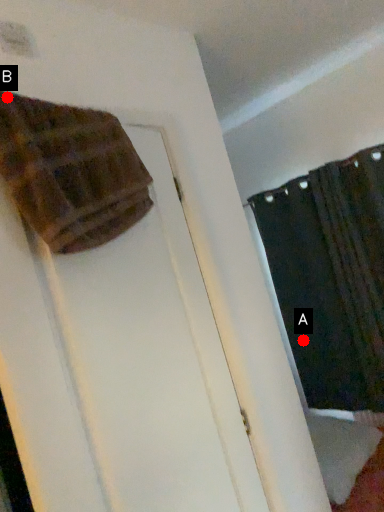
Question: Two points are circled on the image, labeled by A and B beside each circle. Which of the following is the farthest from the observer?

Choices:
 (A) A is further
 (B) B is further

Answer: (A)